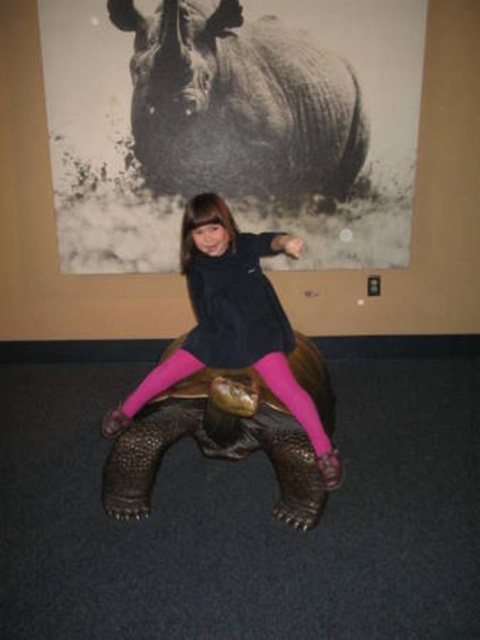
You are standing at the point labeled point (x=274, y=433) in the image. You want to walk to the point labeled point (x=350, y=108). Which direction should you move relative to the tortoise statue?

You should move behind the tortoise statue to reach point (x=350, y=108) since point (x=350, y=108) is behind point (x=274, y=433).